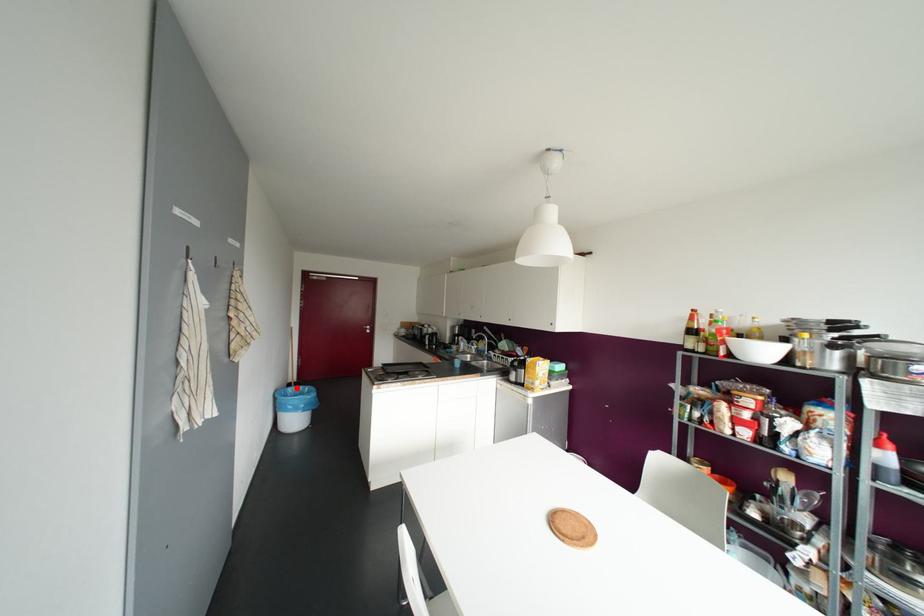
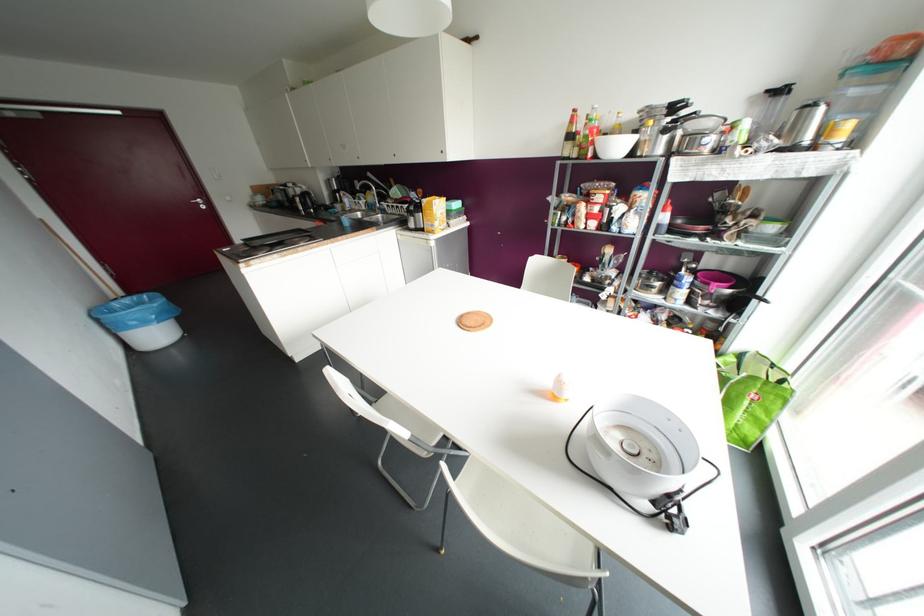
Question: I am providing you with two images of the same scene from different viewpoints. In image1, a red point is highlighted. Considering the same 3D point in image2, which of the following is correct?

Choices:
 (A) It is closer
 (B) It is farther

Answer: (A)